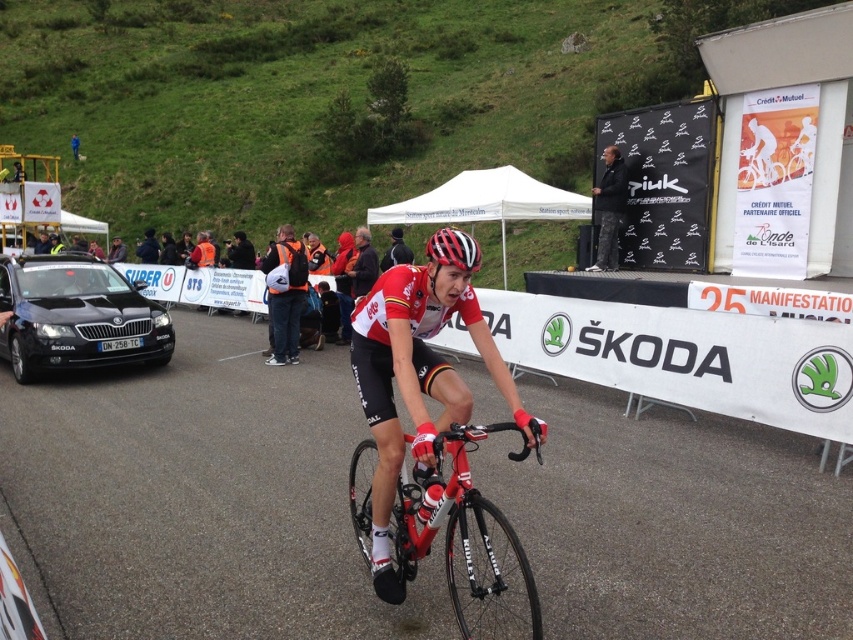
Identify the location of shiny red bicycle at center. The image size is (853, 640). (483, 550).

Is shiny red bicycle at center to the right of black metallic car at left from the viewer's perspective?

Yes, shiny red bicycle at center is to the right of black metallic car at left.

Which is in front, point (355, 458) or point (51, 358)?

Point (355, 458)

Find the location of a particular element. This screenshot has height=640, width=853. shiny red bicycle at center is located at coordinates (483, 550).

Between point (283, 337) and point (618, 163), which one is positioned behind?

The point (618, 163) is behind.

What do you see at coordinates (285, 294) in the screenshot?
I see `orange reflective vest at center` at bounding box center [285, 294].

Who is more forward, (297, 305) or (608, 237)?

Point (297, 305) is in front.

Locate an element on the screen. orange reflective vest at center is located at coordinates (285, 294).

Is smooth asphalt road at center below shiny red bicycle at center?

Indeed, smooth asphalt road at center is positioned under shiny red bicycle at center.

Who is shorter, smooth asphalt road at center or shiny red bicycle at center?

With less height is smooth asphalt road at center.

The image size is (853, 640). Identify the location of smooth asphalt road at center. click(x=196, y=499).